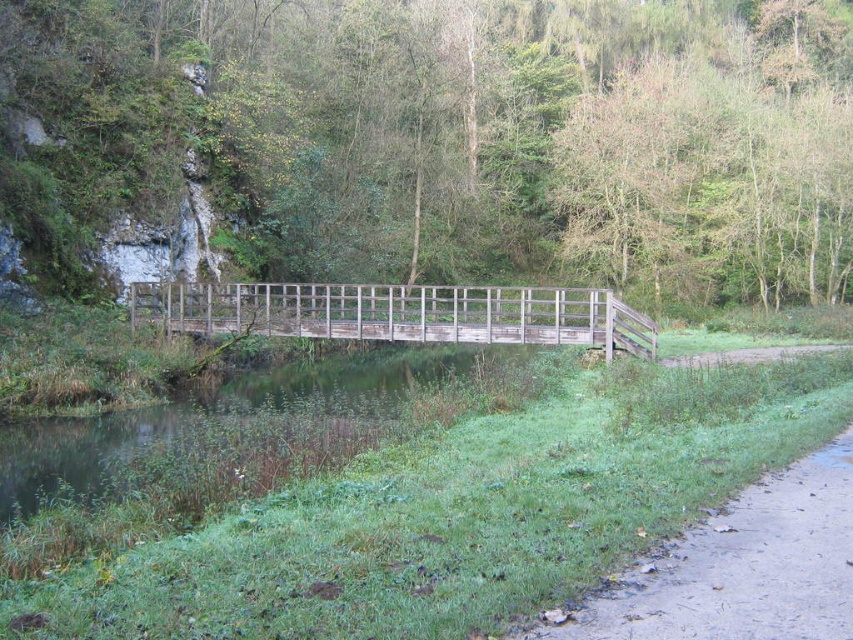
Question: Is dirt path at lower right smaller than weathered wood bridge at center?

Choices:
 (A) yes
 (B) no

Answer: (A)

Question: Among these points, which one is farthest from the camera?

Choices:
 (A) (845, 490)
 (B) (560, 289)

Answer: (B)

Question: Is dirt path at lower right smaller than weathered wood bridge at center?

Choices:
 (A) yes
 (B) no

Answer: (A)

Question: Can you confirm if dirt path at lower right is wider than weathered wood bridge at center?

Choices:
 (A) no
 (B) yes

Answer: (A)

Question: Among these points, which one is farthest from the camera?

Choices:
 (A) (445, 317)
 (B) (791, 592)

Answer: (A)